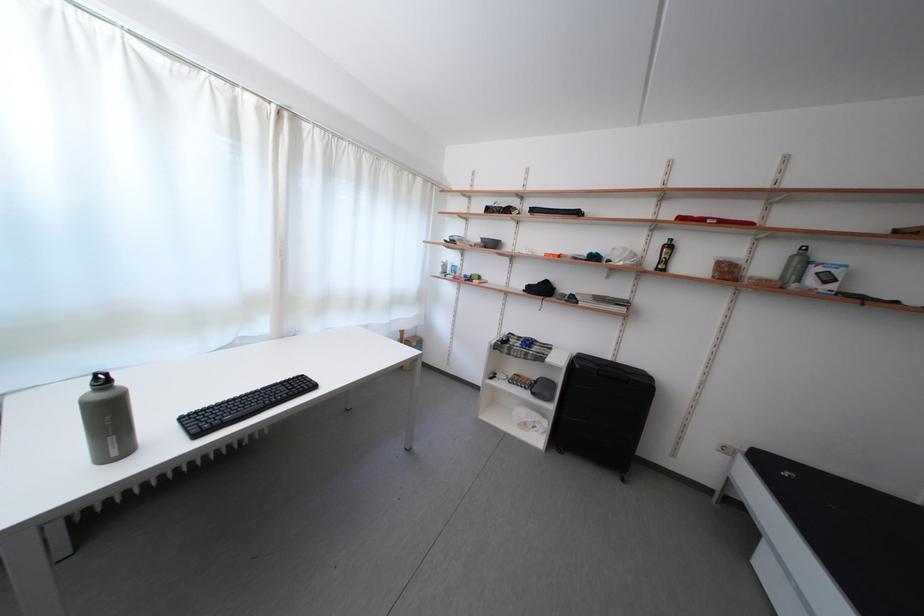
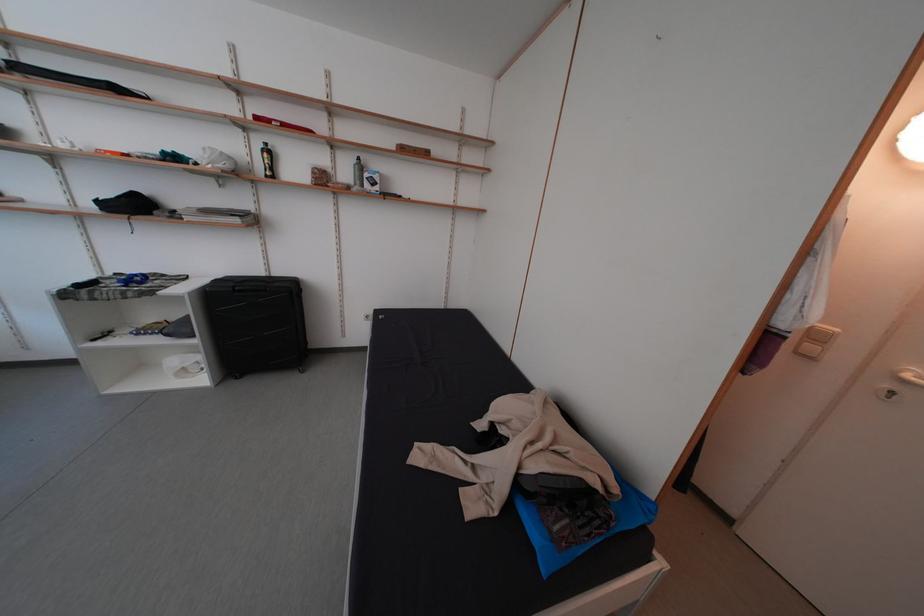
Where in the second image is the point corresponding to (x=774, y=272) from the first image?

(354, 179)